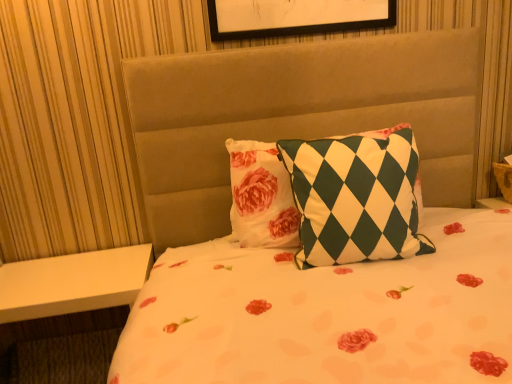
Question: Does white matte table at lower left have a lesser width compared to green and white checkered pillow at center?

Choices:
 (A) no
 (B) yes

Answer: (A)

Question: Does white matte table at lower left have a larger size compared to green and white checkered pillow at center?

Choices:
 (A) no
 (B) yes

Answer: (B)

Question: Can you confirm if white matte table at lower left is positioned to the left of green and white checkered pillow at center?

Choices:
 (A) no
 (B) yes

Answer: (B)

Question: Can you confirm if white matte table at lower left is shorter than green and white checkered pillow at center?

Choices:
 (A) yes
 (B) no

Answer: (B)

Question: Does white matte table at lower left have a smaller size compared to green and white checkered pillow at center?

Choices:
 (A) yes
 (B) no

Answer: (B)

Question: From a real-world perspective, is white matte table at lower left on top of green and white checkered pillow at center?

Choices:
 (A) no
 (B) yes

Answer: (A)

Question: Is white matte table at lower left surrounded by green and white checkered pillow at center?

Choices:
 (A) no
 (B) yes

Answer: (A)

Question: Is green and white checkered pillow at center to the left of white matte table at lower left from the viewer's perspective?

Choices:
 (A) no
 (B) yes

Answer: (A)

Question: Is green and white checkered pillow at center closer to the viewer compared to white matte table at lower left?

Choices:
 (A) no
 (B) yes

Answer: (B)

Question: Is green and white checkered pillow at center facing towards white matte table at lower left?

Choices:
 (A) no
 (B) yes

Answer: (A)

Question: From the image's perspective, would you say green and white checkered pillow at center is shown under white matte table at lower left?

Choices:
 (A) yes
 (B) no

Answer: (B)

Question: Is green and white checkered pillow at center facing away from white matte table at lower left?

Choices:
 (A) no
 (B) yes

Answer: (A)

Question: Which is correct: white matte table at lower left is inside green and white checkered pillow at center, or outside of it?

Choices:
 (A) outside
 (B) inside

Answer: (A)